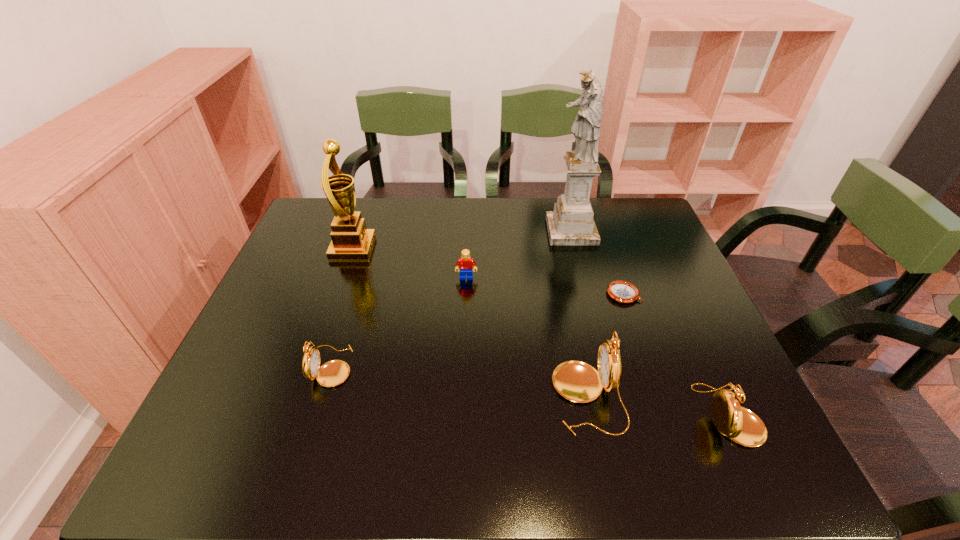
The width and height of the screenshot is (960, 540). What are the coordinates of `location for an additional pocket_watch to make spacing equal` in the screenshot? It's located at pyautogui.click(x=455, y=381).